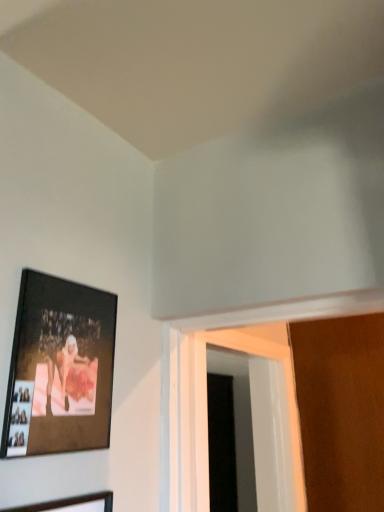
Question: From a real-world perspective, is wooden picture frame at lower left, acting as the first picture frame starting from the bottom, beneath white plastic door at lower right?

Choices:
 (A) yes
 (B) no

Answer: (A)

Question: Is wooden picture frame at lower left, the second picture frame from the top, positioned behind white plastic door at lower right?

Choices:
 (A) yes
 (B) no

Answer: (B)

Question: From the image's perspective, is wooden picture frame at lower left, the second picture frame from the top, located beneath white plastic door at lower right?

Choices:
 (A) yes
 (B) no

Answer: (B)

Question: Can you confirm if wooden picture frame at lower left, acting as the first picture frame starting from the bottom, is thinner than white plastic door at lower right?

Choices:
 (A) no
 (B) yes

Answer: (B)

Question: Is wooden picture frame at lower left, the second picture frame from the top, shorter than white plastic door at lower right?

Choices:
 (A) no
 (B) yes

Answer: (B)

Question: Is wooden picture frame at lower left, the second picture frame from the top, taller than white plastic door at lower right?

Choices:
 (A) yes
 (B) no

Answer: (B)

Question: Is there a large distance between matte black picture frame at upper left, the first picture frame viewed from the top, and wooden picture frame at lower left, acting as the first picture frame starting from the bottom?

Choices:
 (A) yes
 (B) no

Answer: (B)

Question: Is the surface of matte black picture frame at upper left, the first picture frame viewed from the top, in direct contact with wooden picture frame at lower left, acting as the first picture frame starting from the bottom?

Choices:
 (A) no
 (B) yes

Answer: (A)

Question: Does matte black picture frame at upper left, the first picture frame viewed from the top, have a lesser width compared to wooden picture frame at lower left, acting as the first picture frame starting from the bottom?

Choices:
 (A) no
 (B) yes

Answer: (A)

Question: Can you confirm if matte black picture frame at upper left, which is the second picture frame in bottom-to-top order, is positioned to the right of wooden picture frame at lower left, acting as the first picture frame starting from the bottom?

Choices:
 (A) yes
 (B) no

Answer: (B)

Question: Does matte black picture frame at upper left, which is the second picture frame in bottom-to-top order, come behind wooden picture frame at lower left, acting as the first picture frame starting from the bottom?

Choices:
 (A) yes
 (B) no

Answer: (A)

Question: Is matte black picture frame at upper left, which is the second picture frame in bottom-to-top order, oriented away from wooden picture frame at lower left, the second picture frame from the top?

Choices:
 (A) no
 (B) yes

Answer: (A)

Question: From a real-world perspective, is white plastic door at lower right positioned under wooden picture frame at lower left, the second picture frame from the top, based on gravity?

Choices:
 (A) no
 (B) yes

Answer: (A)